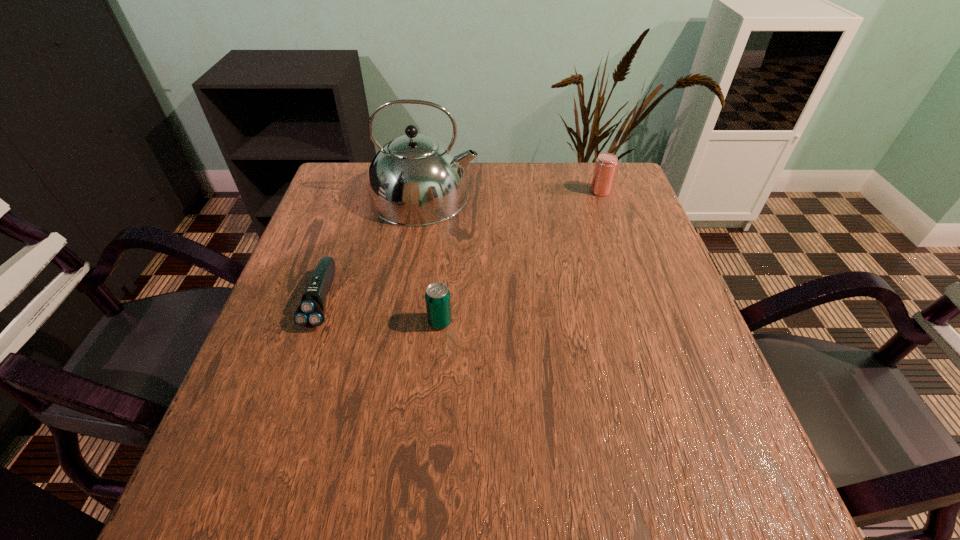
The height and width of the screenshot is (540, 960). Find the location of `kettle present at the far edge`. kettle present at the far edge is located at coordinates (415, 180).

This screenshot has width=960, height=540. I want to click on beer can present at the far edge, so click(606, 163).

At what (x,y) coordinates should I click in order to perform the action: click on kettle situated at the left edge. Please return your answer as a coordinate pair (x, y). The height and width of the screenshot is (540, 960). Looking at the image, I should click on (415, 180).

Locate an element on the screen. electric shaver present at the left edge is located at coordinates (310, 313).

At what (x,y) coordinates should I click in order to perform the action: click on object positioned at the right edge. Please return your answer as a coordinate pair (x, y). The height and width of the screenshot is (540, 960). Looking at the image, I should click on (606, 163).

Locate an element on the screen. object that is positioned at the far left corner is located at coordinates (415, 180).

Where is `object that is at the far right corner`? The image size is (960, 540). object that is at the far right corner is located at coordinates (606, 163).

The image size is (960, 540). Find the location of `vacant space at the far edge of the desktop`. vacant space at the far edge of the desktop is located at coordinates (550, 209).

This screenshot has width=960, height=540. I want to click on free space at the near edge, so click(448, 502).

In the image, there is a desktop. Where is `vacant space at the left edge`? The image size is (960, 540). vacant space at the left edge is located at coordinates (282, 359).